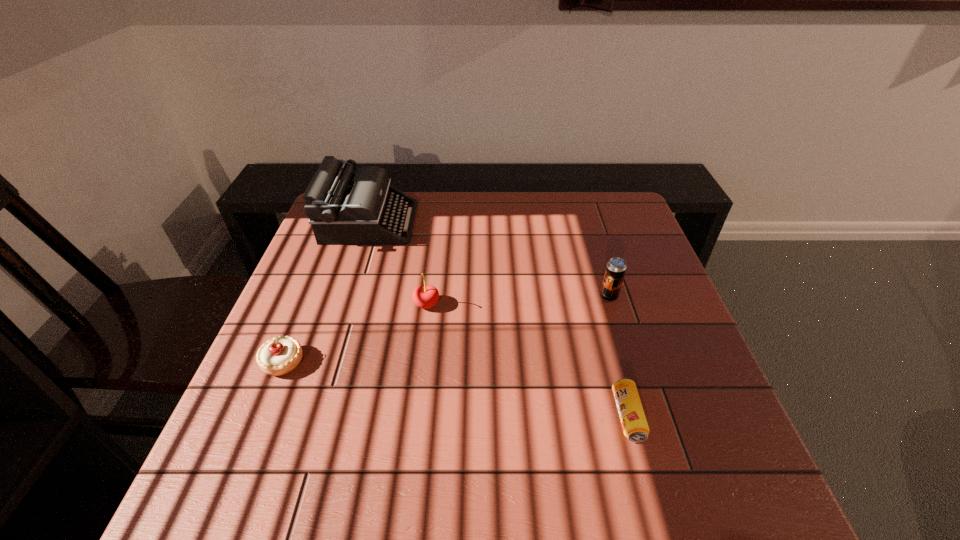
Identify the location of vacant region located on the left of the farther beer can. (444, 296).

The width and height of the screenshot is (960, 540). What are the coordinates of `free space located on the back of the second shortest object` in the screenshot? It's located at (x=330, y=246).

This screenshot has width=960, height=540. What are the coordinates of `vacant area situated on the back of the nearest object` in the screenshot? It's located at [x=594, y=294].

Where is `object located at the far edge`? Image resolution: width=960 pixels, height=540 pixels. object located at the far edge is located at coordinates (344, 207).

At what (x,y) coordinates should I click in order to perform the action: click on typewriter at the left edge. Please return your answer as a coordinate pair (x, y). The height and width of the screenshot is (540, 960). Looking at the image, I should click on (344, 207).

Identify the location of pastry positioned at the left edge. (280, 355).

You are a GUI agent. You are given a task and a screenshot of the screen. Output one action in this format:
    pyautogui.click(x=<x>, y=<y>)
    Task: Click on the object that is at the right edge
    
    Given the screenshot: What is the action you would take?
    pyautogui.click(x=616, y=267)

The height and width of the screenshot is (540, 960). What are the coordinates of `object located at the far left corner` in the screenshot? It's located at pos(344,207).

In the image, there is a desktop. At what (x,y) coordinates should I click in order to perform the action: click on vacant space at the far edge. Please return your answer as a coordinate pair (x, y). Looking at the image, I should click on (564, 221).

In order to click on vacant region at the near edge of the desktop in this screenshot , I will do `click(422, 472)`.